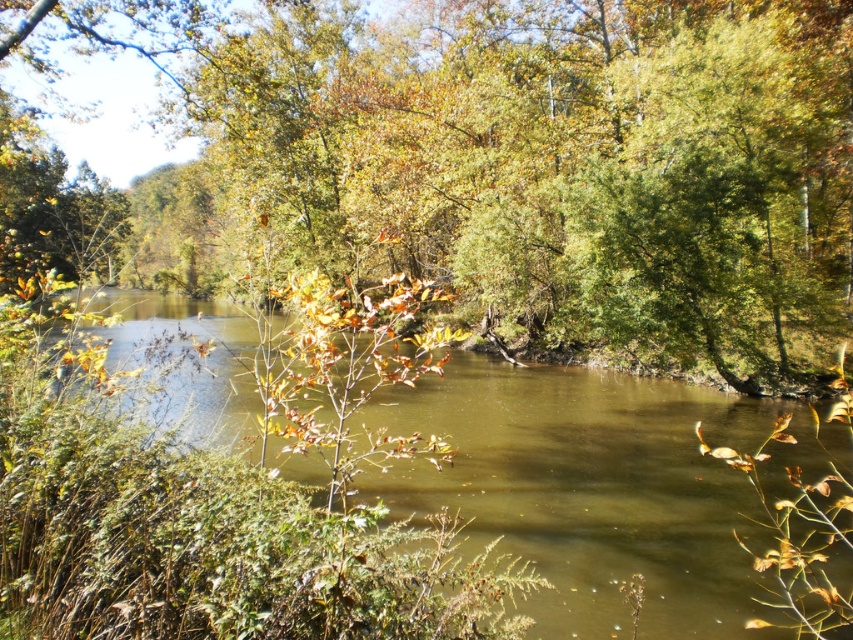
Question: Is green leafy tree at center behind brown murky water at center?

Choices:
 (A) yes
 (B) no

Answer: (A)

Question: Where is green leafy tree at center located in relation to brown murky water at center in the image?

Choices:
 (A) right
 (B) left

Answer: (B)

Question: Does green leafy tree at center have a larger size compared to brown murky water at center?

Choices:
 (A) no
 (B) yes

Answer: (B)

Question: Among these objects, which one is nearest to the camera?

Choices:
 (A) green leafy tree at center
 (B) brown murky water at center

Answer: (B)

Question: Which object appears farthest from the camera in this image?

Choices:
 (A) green leafy tree at center
 (B) brown murky water at center

Answer: (A)

Question: Among these points, which one is nearest to the camera?

Choices:
 (A) click(x=68, y=372)
 (B) click(x=735, y=77)

Answer: (A)